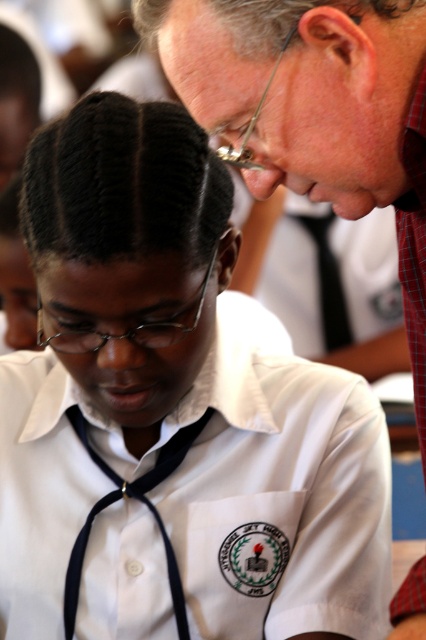
Between white fabric shirt at center and matte black forehead at center, which one appears on the left side from the viewer's perspective?

From the viewer's perspective, matte black forehead at center appears more on the left side.

Is white fabric shirt at center taller than matte black forehead at center?

Correct, white fabric shirt at center is much taller as matte black forehead at center.

Who is more forward, (83,636) or (80,280)?

Point (80,280) is more forward.

You are a GUI agent. You are given a task and a screenshot of the screen. Output one action in this format:
    pyautogui.click(x=<x>, y=<y>)
    Task: Click on the white fabric shirt at center
    This screenshot has width=426, height=640.
    Given the screenshot: What is the action you would take?
    pyautogui.click(x=201, y=499)

Who is higher up, matte red shirt at upper right or matte black forehead at center?

Positioned higher is matte black forehead at center.

Is matte red shirt at upper right to the left of matte black forehead at center from the viewer's perspective?

Incorrect, matte red shirt at upper right is not on the left side of matte black forehead at center.

Measure the distance between point [411,573] and camera.

Point [411,573] is 32.58 inches from camera.

Locate an element on the screen. The image size is (426, 640). matte red shirt at upper right is located at coordinates (314, 108).

Who is shorter, white fabric shirt at center or matte red shirt at upper right?

white fabric shirt at center is shorter.

Is white fabric shirt at center below matte red shirt at upper right?

Correct, white fabric shirt at center is located below matte red shirt at upper right.

Is point (319, 364) positioned after point (270, 38)?

That is True.

Identify the location of white fabric shirt at center. This screenshot has height=640, width=426. (201, 499).